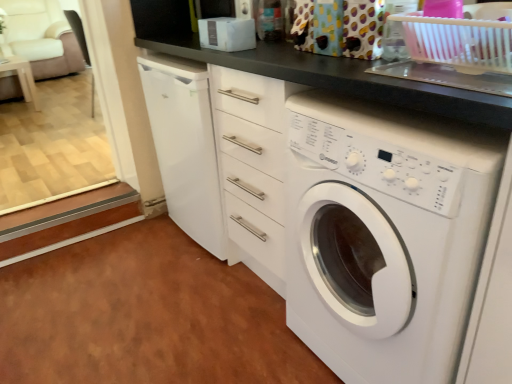
Question: Considering their positions, is white glossy washing machine at center located in front of or behind white glossy table at left?

Choices:
 (A) front
 (B) behind

Answer: (A)

Question: In terms of width, does white glossy washing machine at center look wider or thinner when compared to white glossy table at left?

Choices:
 (A) thin
 (B) wide

Answer: (B)

Question: Which of these objects is positioned closest to the white glossy table at left?

Choices:
 (A) white glossy washing machine at center
 (B) white fabric armchair at upper left
 (C) pink plastic basket at upper right

Answer: (B)

Question: Estimate the real-world distances between objects in this image. Which object is closer to the white fabric armchair at upper left?

Choices:
 (A) white glossy washing machine at center
 (B) pink plastic basket at upper right
 (C) white glossy table at left

Answer: (C)